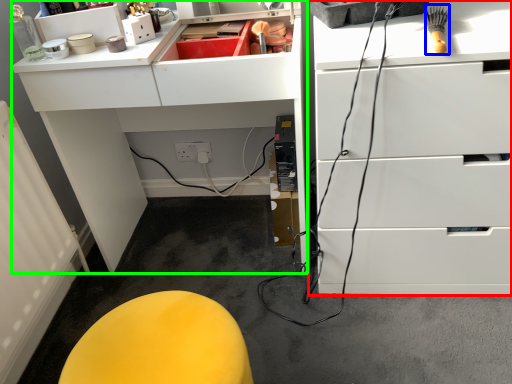
Question: Estimate the real-world distances between objects in this image. Which object is farther from chest of drawers (highlighted by a red box), brush (highlighted by a blue box) or computer desk (highlighted by a green box)?

Choices:
 (A) brush
 (B) computer desk

Answer: (B)